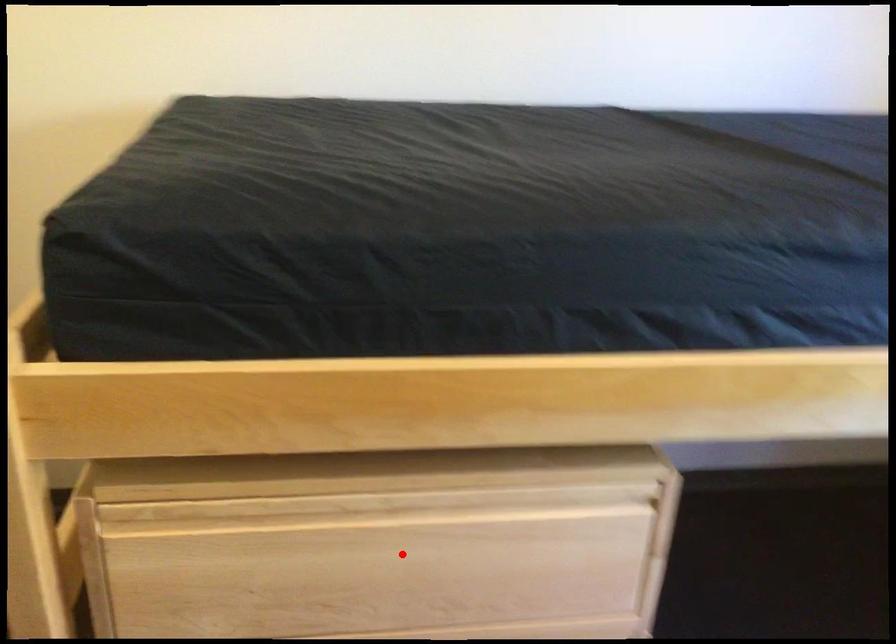
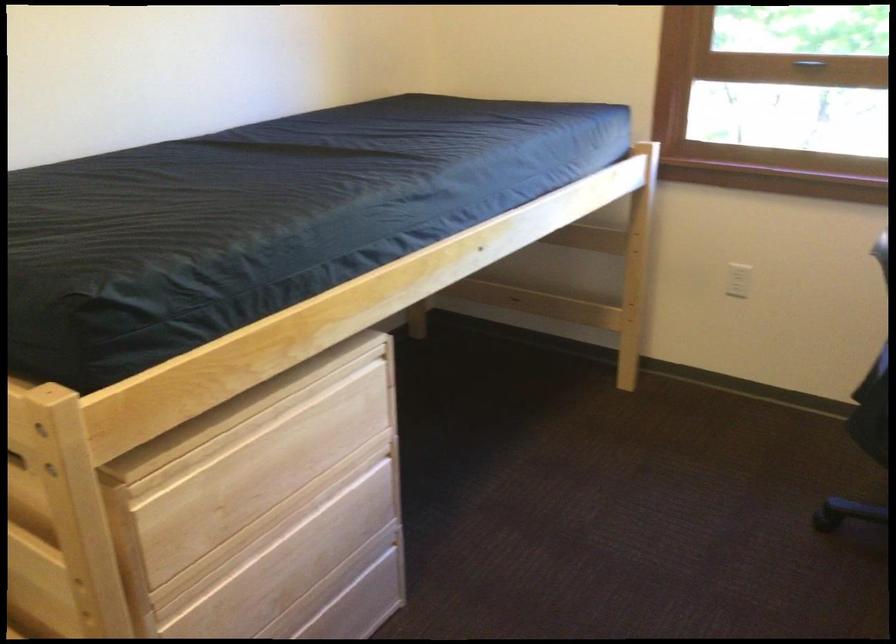
Question: I am providing you with two images of the same scene from different viewpoints. Image1 has a red point marked. In image2, the corresponding 3D location appears at what relative position? Reply with the corresponding letter.

Choices:
 (A) Closer
 (B) Farther

Answer: (B)